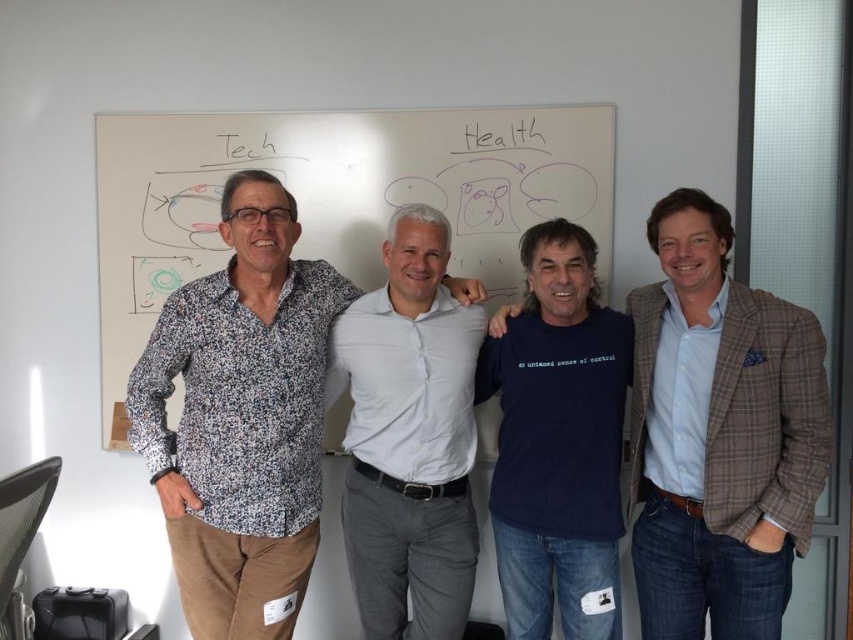
Question: Which object is closer to the camera taking this photo?

Choices:
 (A) printed cotton shirt at center
 (B) dark blue cotton t-shirt at center
 (C) dark blue t-shirt at center

Answer: (C)

Question: Which object is closer to the camera taking this photo?

Choices:
 (A) dark blue cotton t-shirt at center
 (B) printed cotton shirt at center
 (C) dark blue t-shirt at center

Answer: (C)

Question: Does printed cotton shirt at center come behind white cotton shirt at center?

Choices:
 (A) no
 (B) yes

Answer: (A)

Question: Does printed cotton shirt at center have a smaller size compared to dark blue cotton t-shirt at center?

Choices:
 (A) no
 (B) yes

Answer: (A)

Question: Which object is positioned closest to the printed cotton shirt at center?

Choices:
 (A) dark blue t-shirt at center
 (B) dark blue cotton t-shirt at center
 (C) white cotton shirt at center

Answer: (C)

Question: Can you confirm if dark blue t-shirt at center is positioned above dark blue cotton t-shirt at center?

Choices:
 (A) no
 (B) yes

Answer: (B)